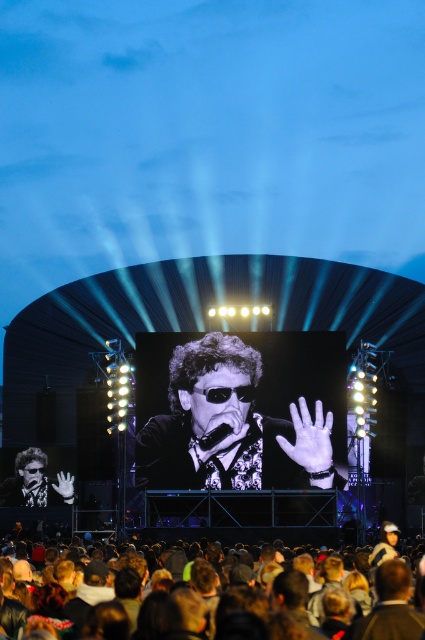
Question: Which point is closer to the camera?

Choices:
 (A) black glossy sunglasses at center
 (B) matte black sunglasses at center

Answer: (A)

Question: Is black glossy sunglasses at center to the right of matte black sunglasses at center from the viewer's perspective?

Choices:
 (A) yes
 (B) no

Answer: (A)

Question: Which point is farther from the camera taking this photo?

Choices:
 (A) (224, 541)
 (B) (51, 493)
 (C) (192, 410)

Answer: (B)

Question: Can you confirm if black glossy sunglasses at center is thinner than brown hair at lower center?

Choices:
 (A) yes
 (B) no

Answer: (A)

Question: Can you confirm if matte black sunglasses at center is positioned to the left of brown hair at lower center?

Choices:
 (A) yes
 (B) no

Answer: (A)

Question: Based on their relative distances, which object is nearer to the brown hair at lower center?

Choices:
 (A) matte black sunglasses at center
 (B) black glossy sunglasses at center

Answer: (A)